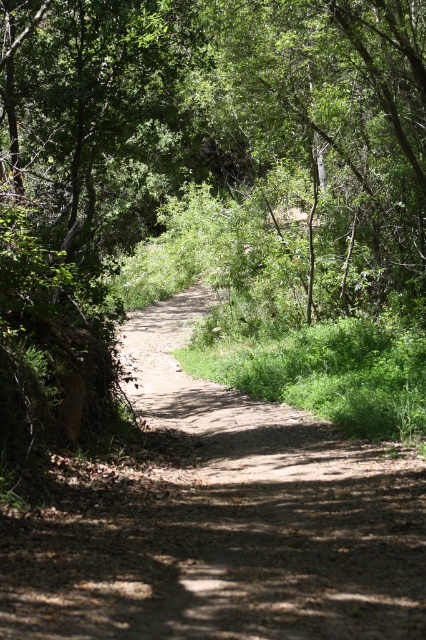
From the picture: You are standing on the dirt path at center and want to walk towards the brown dirt track at center. Which direction should you move to reach it?

You should move forward because the brown dirt track at center is behind the dirt path at center, so walking forward along the dirt path at center will lead you towards it.

You are standing at the point marked by the coordinates point [215,198]. According to the scene description, what is the surface type of the ground beneath your feet?

The surface type of the ground beneath your feet is dirt path at center, as the coordinates point [215,198] marks dirt path at center.